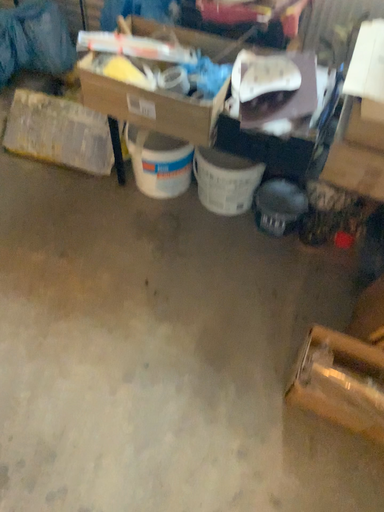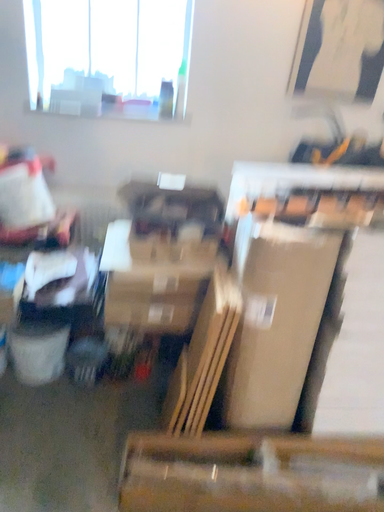
Question: Which way did the camera rotate in the video?

Choices:
 (A) rotated left
 (B) rotated right

Answer: (B)